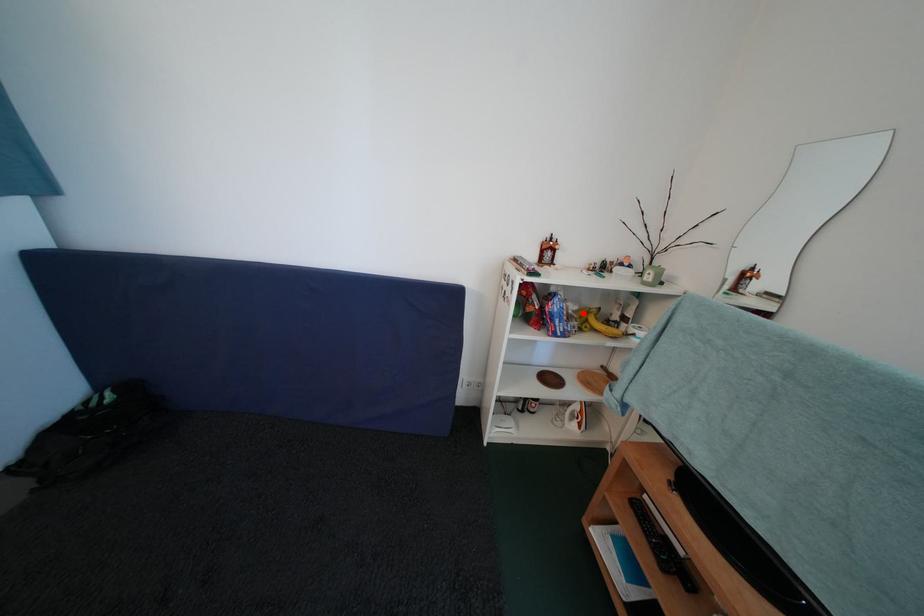
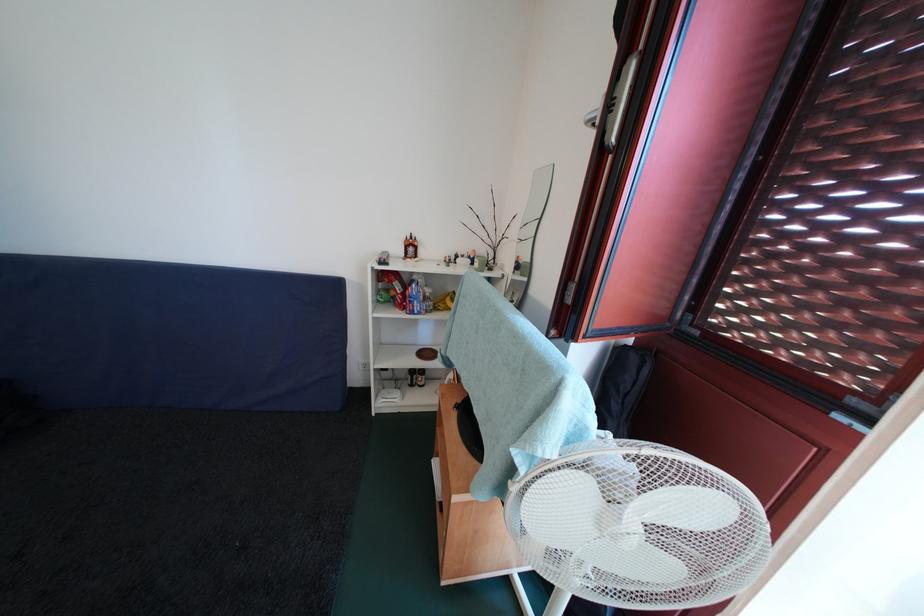
Locate, in the second image, the point that corresponds to the highlighted location in the first image.

(438, 296)